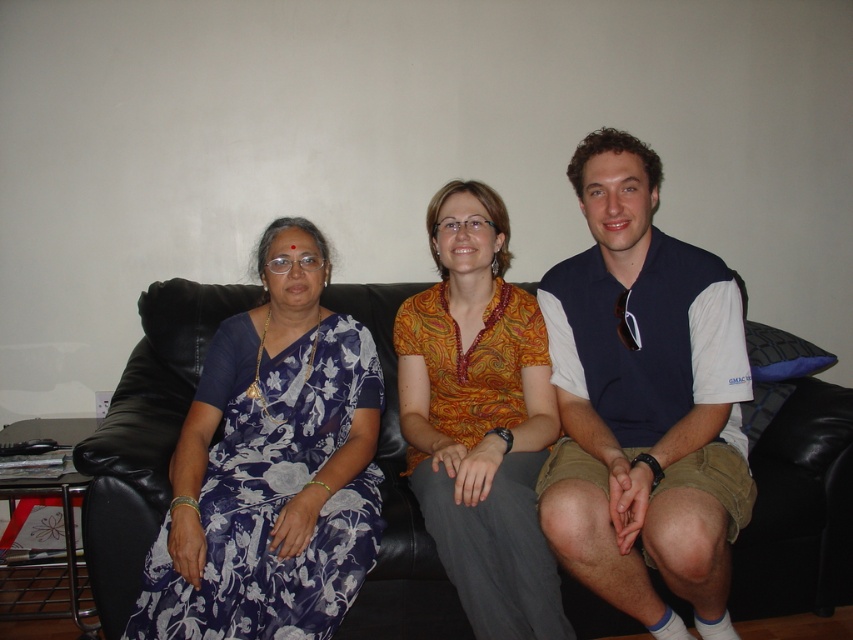
Question: Which of the following is the farthest from the observer?

Choices:
 (A) [x=431, y=636]
 (B) [x=543, y=435]
 (C) [x=567, y=531]

Answer: (A)

Question: Which is farther from the blue floral sari at left?

Choices:
 (A) black plastic goggles at center
 (B) blue cotton polo shirt at center
 (C) black leather couch at center

Answer: (A)

Question: Which of the following is the closest to the observer?

Choices:
 (A) (462, 568)
 (B) (564, 588)

Answer: (A)

Question: Is black leather couch at center above black plastic goggles at center?

Choices:
 (A) no
 (B) yes

Answer: (A)

Question: Can you confirm if black leather couch at center is bigger than black plastic goggles at center?

Choices:
 (A) no
 (B) yes

Answer: (B)

Question: Does blue cotton polo shirt at center come behind black plastic goggles at center?

Choices:
 (A) yes
 (B) no

Answer: (B)